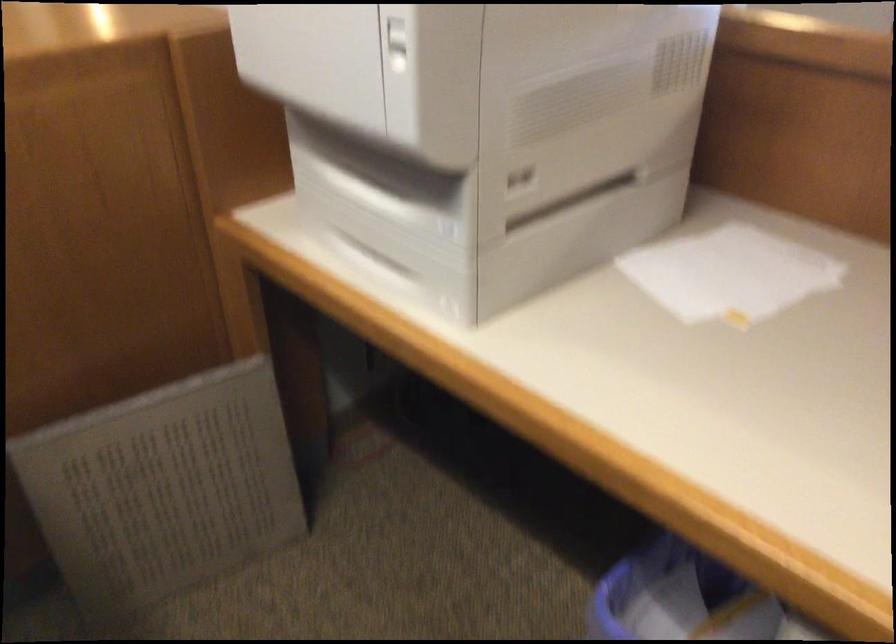
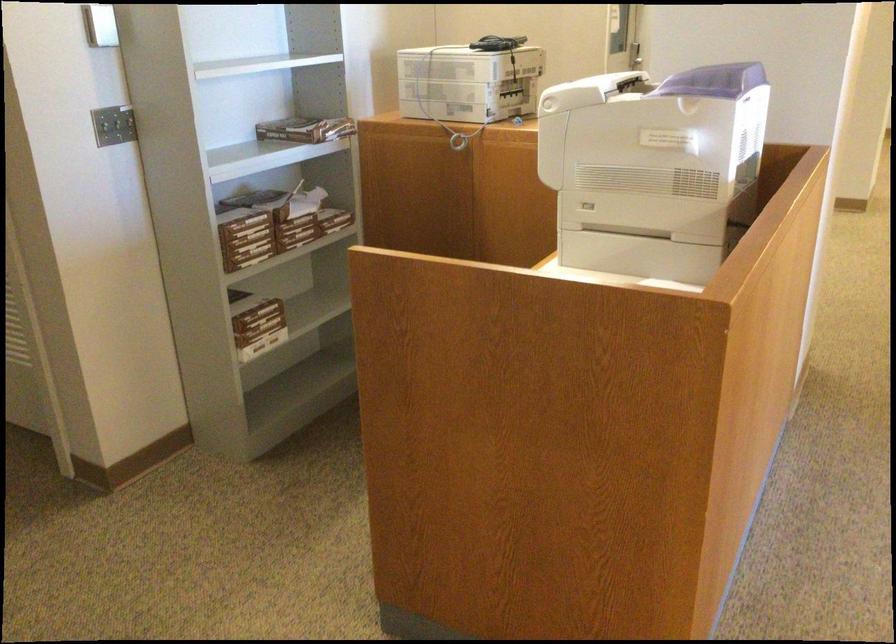
Question: I am providing you with two images of the same scene from different viewpoints. Which of the following objects are not visible in image2?

Choices:
 (A) red pillow
 (B) stack of paper
 (C) black handheld device
 (D) light switch

Answer: (B)